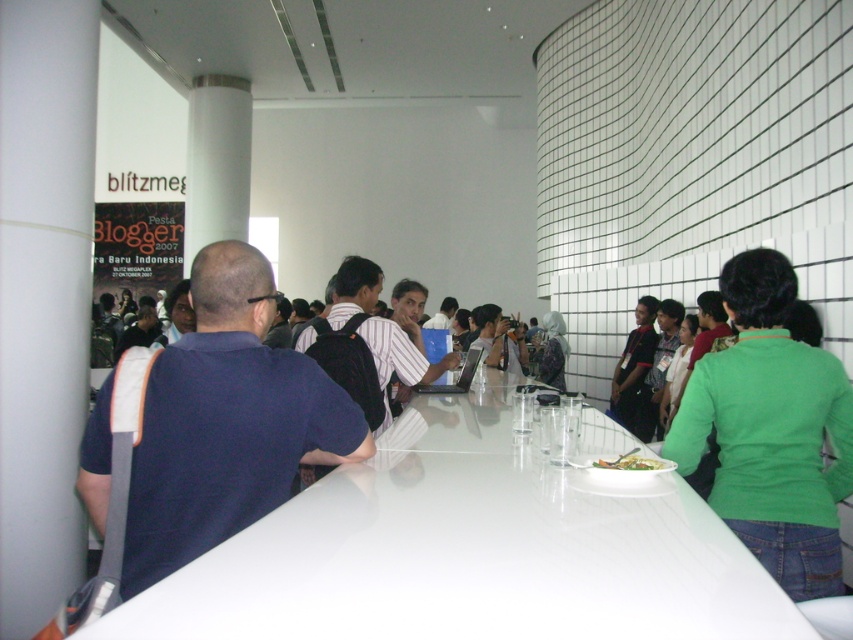
You are a server at the event and need to place a new dish on the table. Considering the white glossy table at center and the green leafy salad at center, which object is higher and can accommodate the dish?

The white glossy table at center is taller than the green leafy salad at center, so you should place the dish on the white glossy table at center.

You are at the event and want to approach the person wearing the dark blue shirt at left to ask a question. If you are standing 1.51 meters away from them, is this distance considered close enough for a conversation without shouting?

The dark blue shirt at left and viewer are 1.51 meters apart, which is a close enough distance for conversation without needing to shout.

You are at the event and want to greet both the person wearing the dark blue shirt at left and the person in the green matte shirt at center. Which one should you approach first to reach them in the shortest path?

You should approach the dark blue shirt at left first because it is closer to you than the green matte shirt at center, so the shortest path would be to the dark blue shirt at left.